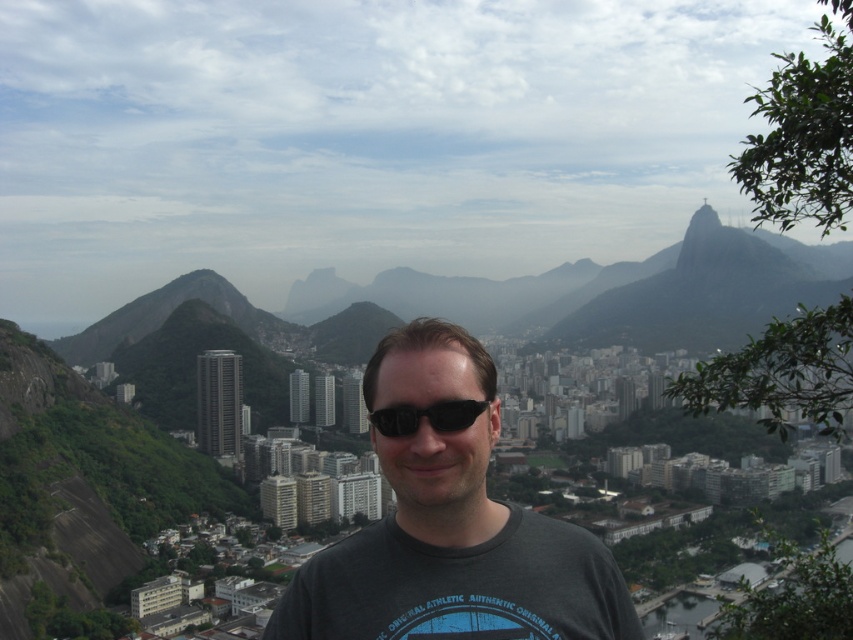
Who is shorter, dark gray t-shirt at center or black plastic sunglasses at center?

With less height is black plastic sunglasses at center.

Can you confirm if dark gray t-shirt at center is thinner than black plastic sunglasses at center?

No.

Is point (585, 621) positioned in front of point (473, 410)?

Yes.

Where is `dark gray t-shirt at center`? dark gray t-shirt at center is located at coordinates (450, 529).